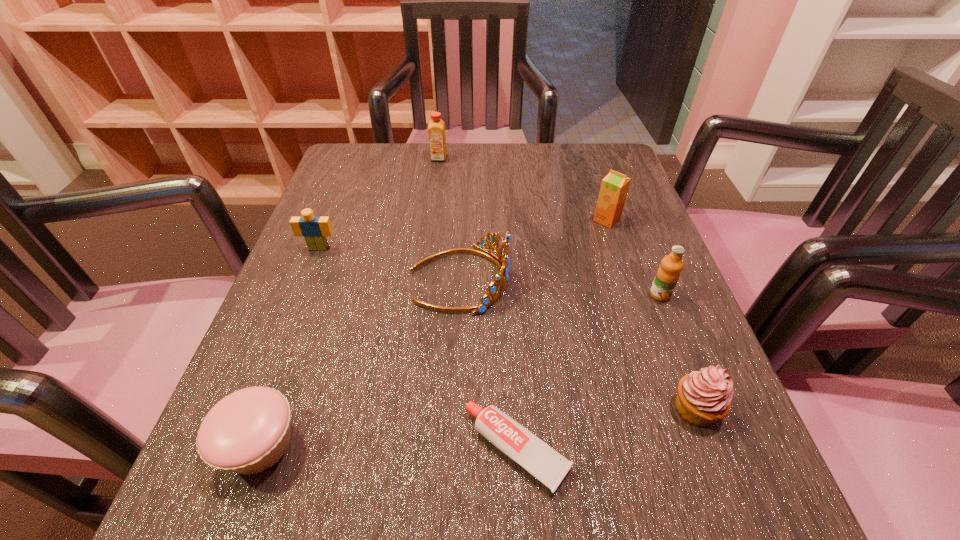
Find the location of a particular element. This screenshot has width=960, height=540. toothpaste is located at coordinates (539, 459).

This screenshot has width=960, height=540. In order to click on free space located on the front and back of the farthest object in this screenshot , I will do `click(430, 225)`.

The image size is (960, 540). I want to click on free location located on the back of the second orange juice from right to left, so click(x=599, y=197).

You are a GUI agent. You are given a task and a screenshot of the screen. Output one action in this format:
    pyautogui.click(x=<x>, y=<y>)
    Task: Click on the vacant area located 0.240m on the front-facing side of the tiara
    Image resolution: width=960 pixels, height=540 pixels.
    Given the screenshot: What is the action you would take?
    pyautogui.click(x=636, y=279)

This screenshot has width=960, height=540. I want to click on free location located 0.290m on the label of the nearest orange juice, so (726, 463).

Identify the location of blank space located on the face of the Lego. The height and width of the screenshot is (540, 960). click(242, 443).

Locate an element on the screen. This screenshot has height=540, width=960. vacant space located on the left of the right cupcake is located at coordinates (488, 409).

Where is `vacant region located 0.330m on the back of the left cupcake`? This screenshot has width=960, height=540. vacant region located 0.330m on the back of the left cupcake is located at coordinates (327, 256).

Locate an element on the screen. The image size is (960, 540). free region located 0.240m on the right of the toothpaste is located at coordinates (744, 449).

This screenshot has width=960, height=540. I want to click on object that is at the far edge, so click(436, 129).